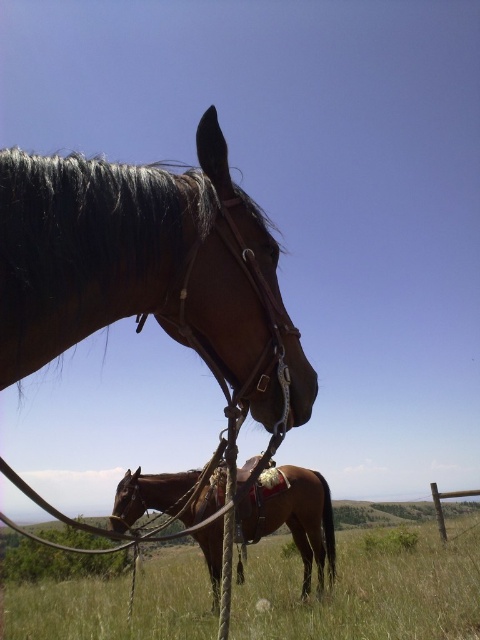
You are a horse trainer assessing the equipment on the two horses in the image. Which piece of equipment, the brown leather bridle at center or the brown leather saddle at center, takes up more space?

The brown leather saddle at center occupies more space than the brown leather bridle at center.

You are a farmer checking the equipment in the field. You notice a point at coordinates (144, 266). Based on the scene, can you determine which object this point is attached to?

The point at coordinates (144, 266) is attached to the brown leather bridle at center.